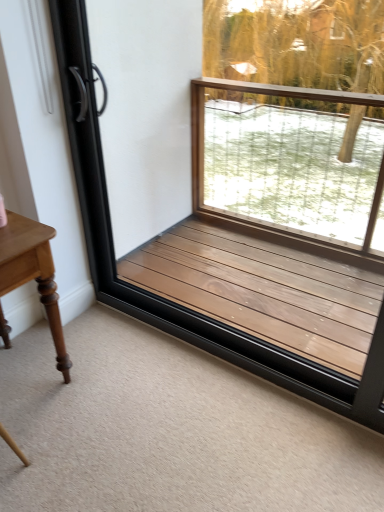
The height and width of the screenshot is (512, 384). Identify the location of vacant space to the right of light brown wood table at left. (114, 384).